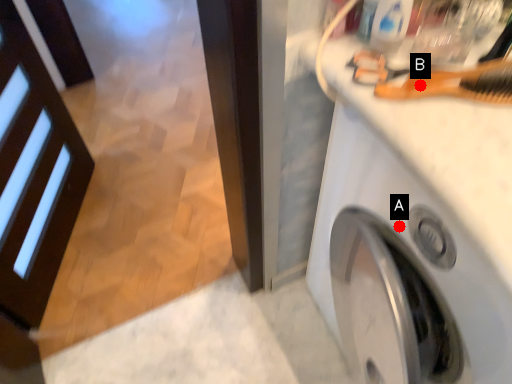
Question: Two points are circled on the image, labeled by A and B beside each circle. Which point is closer to the camera?

Choices:
 (A) A is closer
 (B) B is closer

Answer: (B)